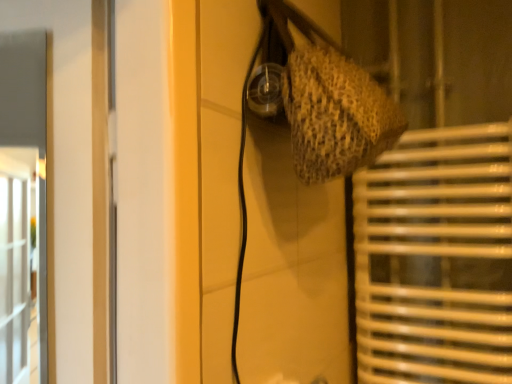
The width and height of the screenshot is (512, 384). I want to click on white matte radiator at right, so click(x=436, y=258).

Describe the element at coordinates (436, 258) in the screenshot. I see `white matte radiator at right` at that location.

Where is `white matte radiator at right`? The width and height of the screenshot is (512, 384). white matte radiator at right is located at coordinates (436, 258).